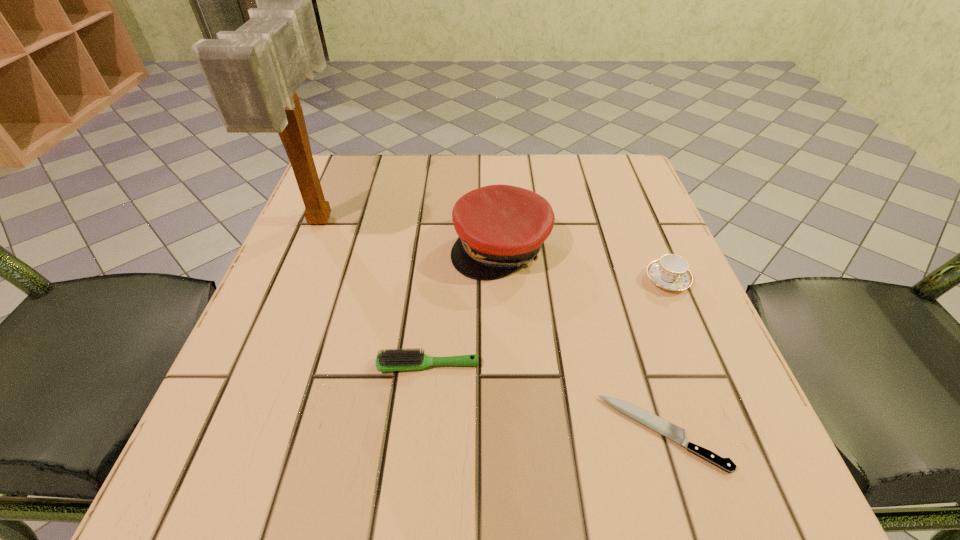
Locate an element on the screen. The image size is (960, 540). vacant region between the steak knife and the hairbrush is located at coordinates (545, 399).

Identify the location of vacant space in between the teacup and the second shortest object. Image resolution: width=960 pixels, height=540 pixels. (547, 322).

This screenshot has height=540, width=960. Identify the location of unoccupied position between the shortest object and the mallet. (492, 326).

Image resolution: width=960 pixels, height=540 pixels. In order to click on unoccupied position between the second tallest object and the nearest object in this screenshot , I will do `click(582, 340)`.

Where is `vacant area that lies between the fourth farthest object and the teacup`? Image resolution: width=960 pixels, height=540 pixels. vacant area that lies between the fourth farthest object and the teacup is located at coordinates (547, 322).

Select which object appears as the closest to the third shortest object. Please provide its 2D coordinates. Your answer should be formatted as a tuple, i.e. [(x, y)], where the tuple contains the x and y coordinates of a point satisfying the conditions above.

[(501, 228)]

At what (x,y) coordinates should I click in order to perform the action: click on object that can be found as the closest to the steak knife. Please return your answer as a coordinate pair (x, y). Looking at the image, I should click on (388, 360).

Where is `vacant point that satisfies the following two spatial constraints: 1. on the front side of the nearest object; 2. on the left side of the hairbrush`? This screenshot has height=540, width=960. vacant point that satisfies the following two spatial constraints: 1. on the front side of the nearest object; 2. on the left side of the hairbrush is located at coordinates (420, 433).